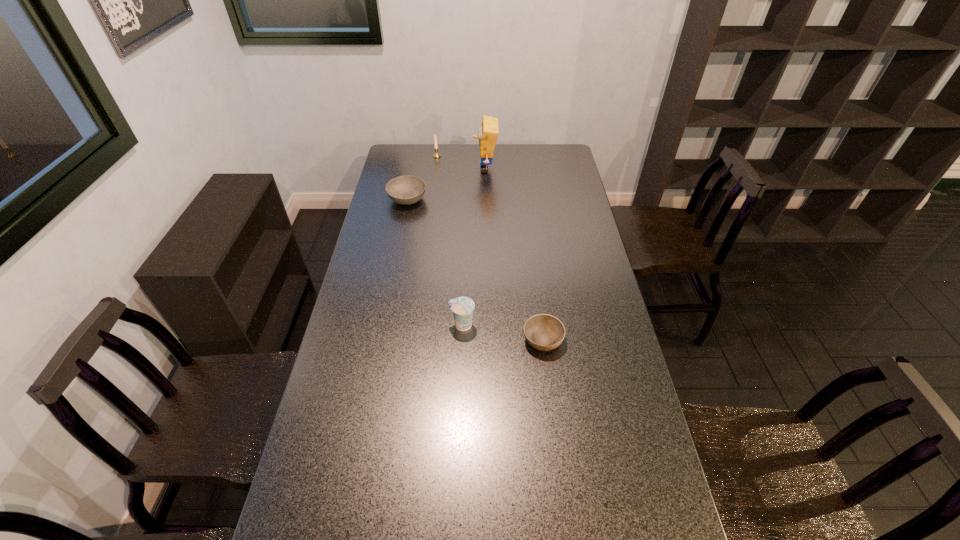
In order to click on the second closest bowl to the yogurt in this screenshot , I will do `click(406, 190)`.

The height and width of the screenshot is (540, 960). I want to click on vacant space that satisfies the following two spatial constraints: 1. on the face of the sponge; 2. on the left side of the right bowl, so click(x=488, y=340).

Find the location of a particular element. free spot that satisfies the following two spatial constraints: 1. on the back side of the second tallest object; 2. on the left side of the second shortest object is located at coordinates (416, 156).